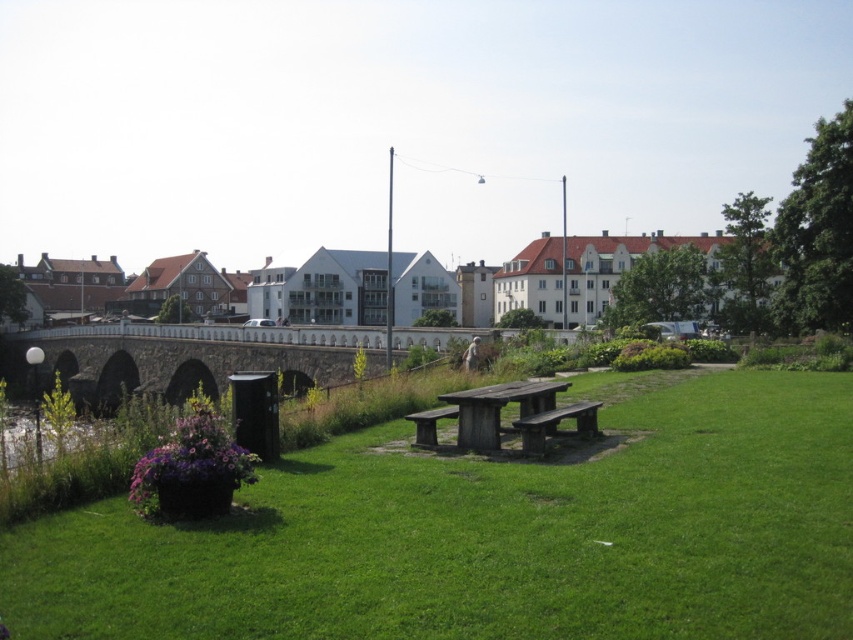
You are a park visitor standing at the entrance of the park. You want to reach the wooden picnic table at center. Which direction should you walk to avoid walking over the green grassy park at center?

The green grassy park at center is in front of the wooden picnic table at center, so you should walk around the green grassy park at center to reach the wooden picnic table at center without walking over it.

You are planning to take a photo of the stone arch bridge at center and the wooden bench at center from the grassy area. Which object should you frame first in your camera viewfinder to ensure both are in the shot?

You should frame the stone arch bridge at center first since it is to the left of the wooden bench at center, allowing both to be included in the photo when positioned correctly.

You are planning to host a small gathering in the park and need to seat 6 people. The wooden picnic table at center and wooden park bench at center are available. Which one can accommodate more people?

The wooden picnic table at center has a larger size compared to the wooden park bench at center, so it can accommodate more people.